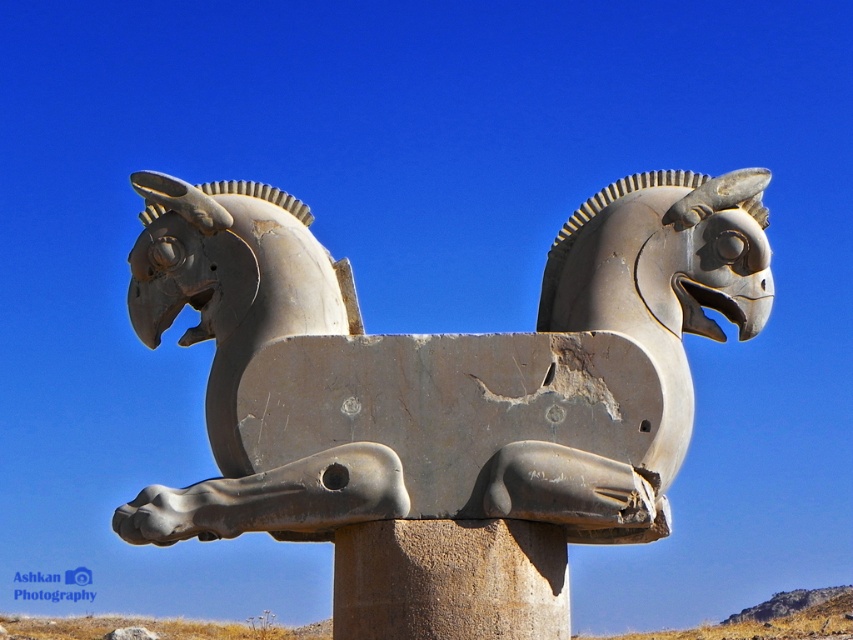
You are an art conservator assessing the stability of the gray stone sculpture at center and the rusty stone pillar at center. Based on their sizes, which object might require more support to prevent toppling over?

The gray stone sculpture at center is bigger than the rusty stone pillar at center, so the sculpture might require more support to prevent toppling over due to its larger size and potential higher center of gravity.